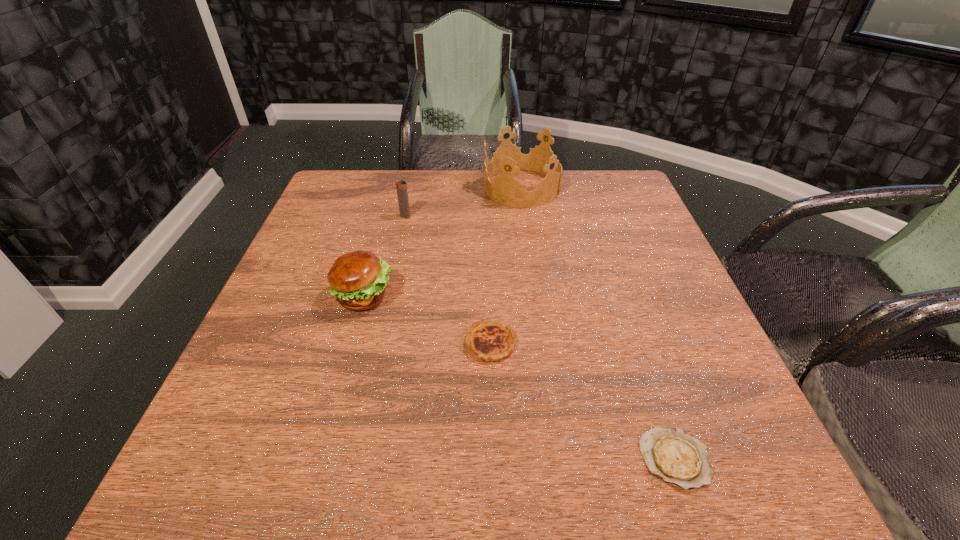
Identify the location of vacant area in the image that satisfies the following two spatial constraints: 1. on the front-facing side of the tiara; 2. on the left side of the right quiche. Image resolution: width=960 pixels, height=540 pixels. (559, 458).

The height and width of the screenshot is (540, 960). Identify the location of vacant area that satisfies the following two spatial constraints: 1. on the front-facing side of the farthest object; 2. on the front side of the hamburger. (537, 296).

Where is `free point that satisfies the following two spatial constraints: 1. on the front side of the taller quiche; 2. on the left side of the nearest object`? This screenshot has height=540, width=960. free point that satisfies the following two spatial constraints: 1. on the front side of the taller quiche; 2. on the left side of the nearest object is located at coordinates (493, 458).

Locate an element on the screen. free space that satisfies the following two spatial constraints: 1. on the front side of the hamburger; 2. on the right side of the fourth tallest object is located at coordinates (350, 343).